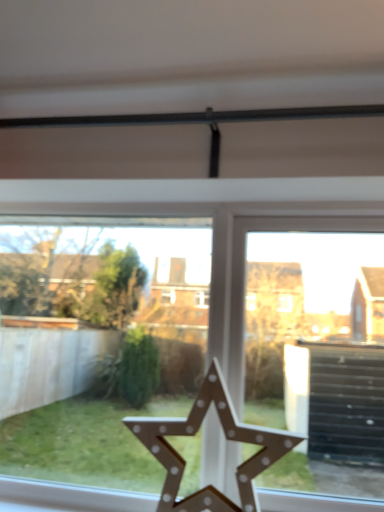
In order to face wooden star at center, should I rotate leftwards or rightwards?

You should look right and rotate roughly 2.399 degrees.

You are a GUI agent. You are given a task and a screenshot of the screen. Output one action in this format:
    pyautogui.click(x=<x>, y=<y>)
    Task: Click on the wooden star at center
    The height and width of the screenshot is (512, 384).
    Given the screenshot: What is the action you would take?
    pyautogui.click(x=226, y=437)

This screenshot has height=512, width=384. What do you see at coordinates (226, 437) in the screenshot?
I see `wooden star at center` at bounding box center [226, 437].

In order to face wooden star at center, should I rotate leftwards or rightwards?

It's best to rotate left around 2.742 degrees.

The height and width of the screenshot is (512, 384). What do you see at coordinates (71, 413) in the screenshot?
I see `wooden star at center` at bounding box center [71, 413].

Find the location of `wooden star at center`. wooden star at center is located at coordinates (71, 413).

Where is `wooden star at center`? This screenshot has height=512, width=384. wooden star at center is located at coordinates (226, 437).

Which is more to the left, wooden star at center or wooden star at center?

wooden star at center.

In the image, is wooden star at center positioned in front of or behind wooden star at center?

In the image, wooden star at center appears behind wooden star at center.

Does point (95, 233) appear closer or farther from the camera than point (218, 498)?

Point (95, 233) is positioned farther from the camera compared to point (218, 498).

In the scene shown: From the image's perspective, does wooden star at center appear lower than wooden star at center?

No.

From a real-world perspective, is wooden star at center on top of wooden star at center?

Yes, from a real-world perspective, wooden star at center is above wooden star at center.

Does wooden star at center have a lesser width compared to wooden star at center?

Indeed, wooden star at center has a lesser width compared to wooden star at center.

Which of these two, wooden star at center or wooden star at center, stands taller?

With more height is wooden star at center.

Does wooden star at center have a larger size compared to wooden star at center?

Yes, wooden star at center is bigger than wooden star at center.

Would you say wooden star at center is inside or outside wooden star at center?

The correct answer is: outside.

Is wooden star at center directly adjacent to wooden star at center?

No, wooden star at center is not beside wooden star at center.

Could you tell me if wooden star at center is turned towards wooden star at center?

Yes, wooden star at center faces towards wooden star at center.

What's the angular difference between wooden star at center and wooden star at center's facing directions?

There is a 0.668-degree angle between the facing directions of wooden star at center and wooden star at center.

Measure the distance between wooden star at center and wooden star at center.

wooden star at center and wooden star at center are 21.59 inches apart from each other.

Find the location of a particular element. window behind the wooden star at center is located at coordinates (71, 413).

Which is more to the right, wooden star at center or wooden star at center?

From the viewer's perspective, wooden star at center appears more on the right side.

Considering the relative positions of wooden star at center and wooden star at center in the image provided, is wooden star at center behind wooden star at center?

No, it is not.

Considering the points (176, 476) and (170, 316), which point is in front, point (176, 476) or point (170, 316)?

The point (176, 476) is closer to the camera.

From the image's perspective, who appears lower, wooden star at center or wooden star at center?

wooden star at center.

In the scene shown: From a real-world perspective, which object rests below the other?

In real-world perspective, wooden star at center is lower.

Between wooden star at center and wooden star at center, which one has smaller width?

wooden star at center is thinner.

Which of these two, wooden star at center or wooden star at center, stands shorter?

With less height is wooden star at center.

Looking at the image, does wooden star at center seem bigger or smaller compared to wooden star at center?

In the image, wooden star at center appears to be smaller than wooden star at center.

Is wooden star at center completely or partially outside of wooden star at center?

wooden star at center lies outside wooden star at center's area.

Would you consider wooden star at center to be distant from wooden star at center?

That's not correct — wooden star at center is a little close to wooden star at center.

Is wooden star at center turned away from wooden star at center?

Absolutely, wooden star at center is directed away from wooden star at center.

From the picture: How much distance is there between wooden star at center and wooden star at center?

wooden star at center is 21.59 inches from wooden star at center.

Where is `window that is above the wooden star at center (from a real-world perspective)`? window that is above the wooden star at center (from a real-world perspective) is located at coordinates 71,413.

The height and width of the screenshot is (512, 384). What are the coordinates of `window behind the wooden star at center` in the screenshot? It's located at (71, 413).

Locate an element on the screen. Image resolution: width=384 pixels, height=512 pixels. window on the left of wooden star at center is located at coordinates (71, 413).